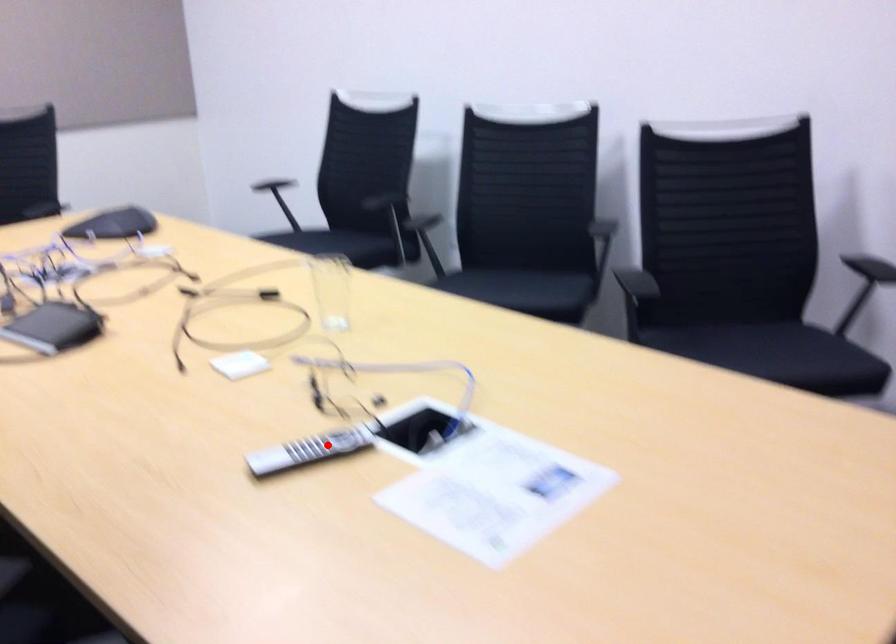
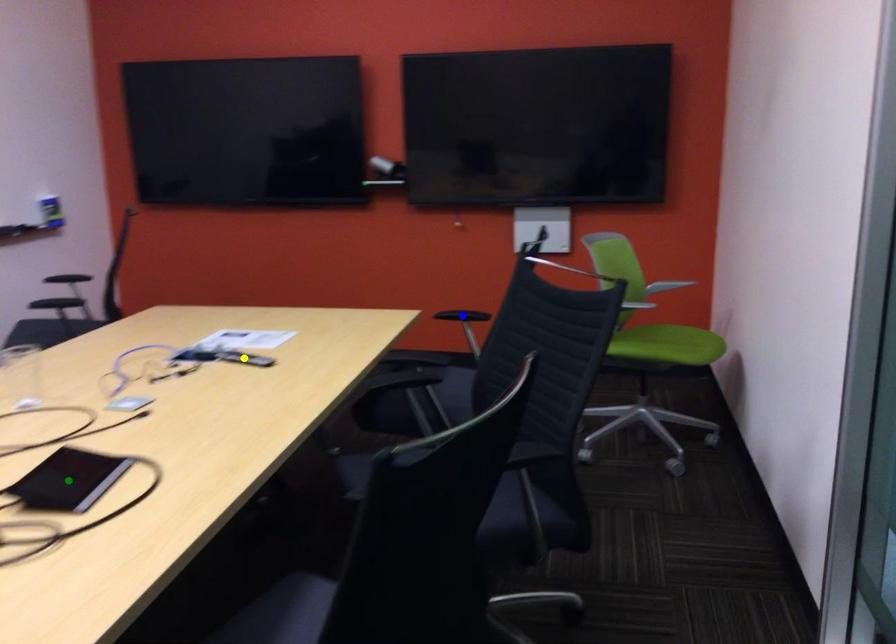
Question: I am providing you with two images of the same scene from different viewpoints. A red point is marked on the first image. You are given multiple points on the second image. In image 2, which mark is for the same physical point as the one in image 1?

Choices:
 (A) blue point
 (B) green point
 (C) yellow point

Answer: (C)